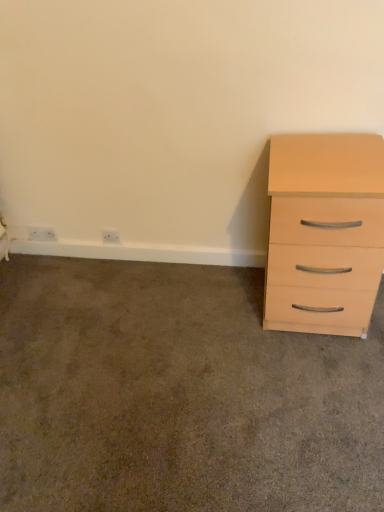
Question: Can you confirm if white plastic electric outlet at lower left, which ranks as the first electric outlet in left-to-right order, is bigger than beige wood drawer at right?

Choices:
 (A) yes
 (B) no

Answer: (B)

Question: Is white plastic electric outlet at lower left, the 2th electric outlet when ordered from right to left, to the right of beige wood drawer at right from the viewer's perspective?

Choices:
 (A) no
 (B) yes

Answer: (A)

Question: Are white plastic electric outlet at lower left, the 2th electric outlet when ordered from right to left, and beige wood drawer at right located far from each other?

Choices:
 (A) yes
 (B) no

Answer: (A)

Question: Is white plastic electric outlet at lower left, the 2th electric outlet when ordered from right to left, thinner than beige wood drawer at right?

Choices:
 (A) no
 (B) yes

Answer: (B)

Question: Is white plastic electric outlet at lower left, the 2th electric outlet when ordered from right to left, taller than beige wood drawer at right?

Choices:
 (A) yes
 (B) no

Answer: (A)

Question: Is white plastic electric outlet at lower left, which ranks as the first electric outlet in left-to-right order, aimed at beige wood drawer at right?

Choices:
 (A) no
 (B) yes

Answer: (A)

Question: Is white plastic electric outlet at lower left, the 2th electric outlet when ordered from right to left, to the right of light wood/finish chest of drawers at right from the viewer's perspective?

Choices:
 (A) yes
 (B) no

Answer: (B)

Question: Is light wood/finish chest of drawers at right located within white plastic electric outlet at lower left, which ranks as the first electric outlet in left-to-right order?

Choices:
 (A) no
 (B) yes

Answer: (A)

Question: Can you confirm if white plastic electric outlet at lower left, which ranks as the first electric outlet in left-to-right order, is wider than light wood/finish chest of drawers at right?

Choices:
 (A) yes
 (B) no

Answer: (B)

Question: Does white plastic electric outlet at lower left, which ranks as the first electric outlet in left-to-right order, have a lesser height compared to light wood/finish chest of drawers at right?

Choices:
 (A) no
 (B) yes

Answer: (B)

Question: Does white plastic electric outlet at lower left, the 2th electric outlet when ordered from right to left, turn towards light wood/finish chest of drawers at right?

Choices:
 (A) yes
 (B) no

Answer: (B)

Question: Is the surface of white plastic electric outlet at lower left, which ranks as the first electric outlet in left-to-right order, in direct contact with light wood/finish chest of drawers at right?

Choices:
 (A) yes
 (B) no

Answer: (B)

Question: Is white plastic electric outlet at lower left, which ranks as the first electric outlet in left-to-right order, directly adjacent to white plastic outlet at lower left, the second electric outlet from the left?

Choices:
 (A) yes
 (B) no

Answer: (B)